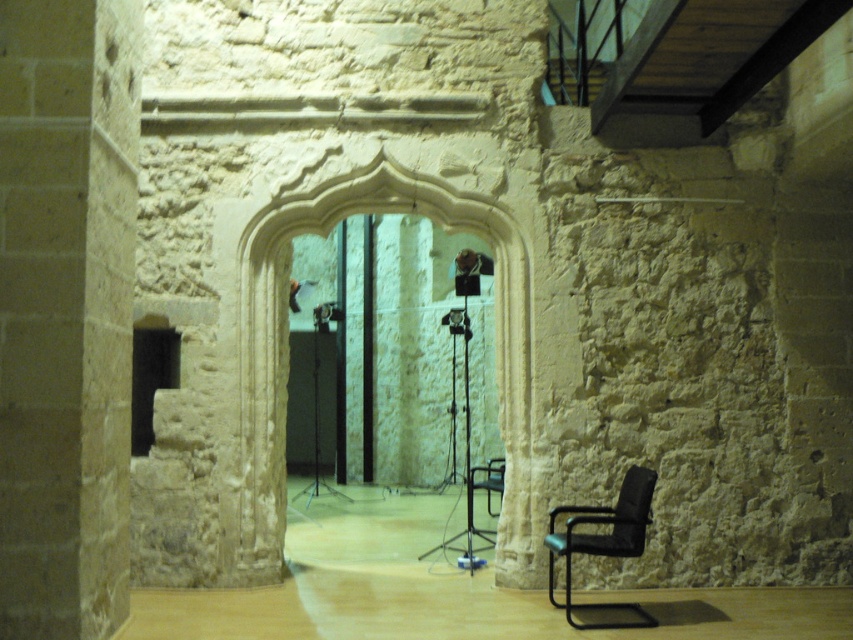
Looking at this image, you are a photographer setting up equipment in the room with the arched doorway. You need to place a new light stand between the smooth stone pillar at left and the black leather armchair at lower right. Based on their positions, which object should the light stand be closer to?

Answer: The light stand should be placed closer to the smooth stone pillar at left since it is positioned to the left of the black leather armchair at lower right.

You are a photographer setting up for a shoot. You want to position your camera exactly halfway between the white stone archway at center and the two black tripod lights. Can you do this without moving the existing lights?

The white stone archway at center and camera are 6.08 meters apart. The two black tripod lights are positioned symmetrically on either side of the doorway. To position the camera halfway between the archway and the lights, the distance from the archway to the camera would need to be half of 6.08 meters, which is 3.04 meters. However, since the existing lights are already placed symmetrically, moving the camera to this midpoint might interfere with their positioning. Therefore, it is not advisable to move it

You are an interior designer planning to install a new light fixture. You have two options to choose from. One is a tall, modern pendant light that requires a mounting height of at least 2 meters. The other is a smaller, wall sconce that can be mounted lower. Based on the smooth stone pillar at left and the white stone archway at center, which object would be suitable for mounting the pendant light and why?

The smooth stone pillar at left is much taller than the white stone archway at center, so the pendant light requiring a mounting height of at least 2 meters would be suitable for the smooth stone pillar at left. The white stone archway at center is shorter and better suited for the smaller wall sconce.